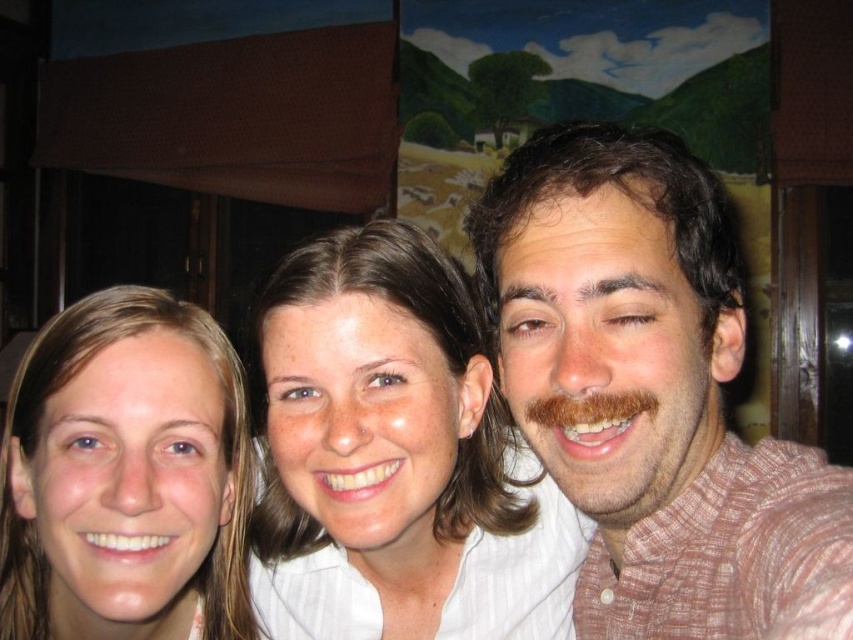
Question: Considering the real-world distances, which object is closest to the brown hair at right?

Choices:
 (A) brownwoollybeard at right
 (B) smooth white shirt at center

Answer: (A)

Question: Can you confirm if smooth skin face at center is bigger than brownwoollybeard at right?

Choices:
 (A) no
 (B) yes

Answer: (B)

Question: Does brown hair at right have a larger size compared to smooth white shirt at center?

Choices:
 (A) no
 (B) yes

Answer: (A)

Question: Can you confirm if brown hair at right is positioned below smooth skin face at center?

Choices:
 (A) yes
 (B) no

Answer: (B)

Question: Which point is farther to the camera?

Choices:
 (A) smooth skin face at center
 (B) brown hair at right
 (C) brownwoollybeard at right

Answer: (A)

Question: Which object appears farthest from the camera in this image?

Choices:
 (A) brownwoollybeard at right
 (B) smooth white shirt at center
 (C) smooth skin face at center
 (D) brown hair at right

Answer: (C)